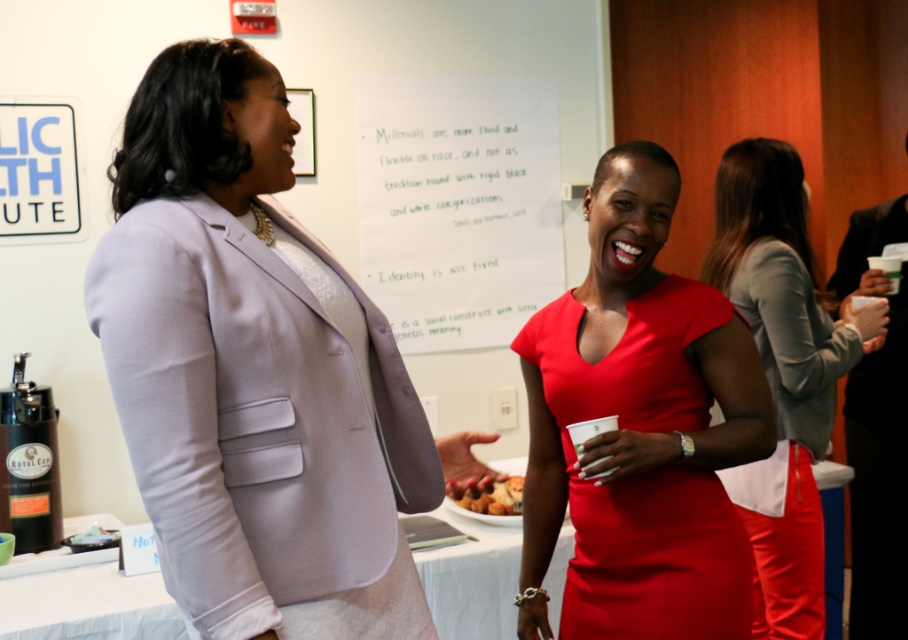
Question: Where is white paper at center located in relation to black smooth suit at right in the image?

Choices:
 (A) below
 (B) above

Answer: (B)

Question: Among these objects, which one is farthest from the camera?

Choices:
 (A) lavender fabric blazer at upper left
 (B) black smooth suit at right
 (C) golden brown crispy pastry at center
 (D) white paper at center

Answer: (D)

Question: Which point is closer to the camera?

Choices:
 (A) black smooth suit at right
 (B) matte red dress at center
 (C) matte gray blazer at center
 (D) golden brown crispy pastry at center

Answer: (B)

Question: Can you confirm if lavender fabric blazer at upper left is wider than golden brown crispy pastry at center?

Choices:
 (A) yes
 (B) no

Answer: (A)

Question: Which point is closer to the camera?

Choices:
 (A) black smooth suit at right
 (B) lavender fabric blazer at upper left

Answer: (B)

Question: Is matte red dress at center to the right of black smooth suit at right from the viewer's perspective?

Choices:
 (A) no
 (B) yes

Answer: (A)